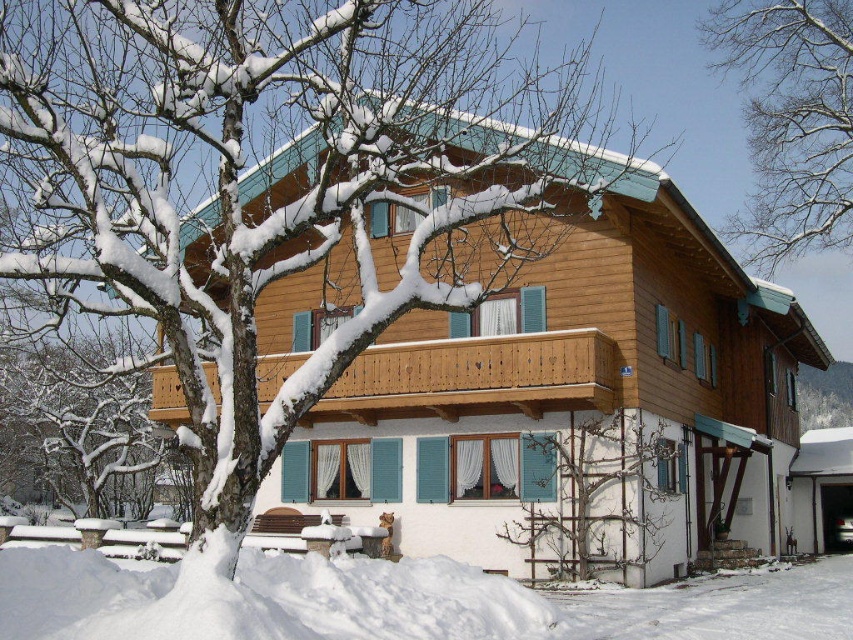
Between bare branches at upper center and wooden at center, which one is positioned lower?

wooden at center is lower down.

Can you confirm if bare branches at upper center is taller than wooden at center?

Yes.

Between point (811, 48) and point (355, 372), which one is positioned in front?

Point (355, 372)

Find the location of a particular element. The image size is (853, 640). bare branches at upper center is located at coordinates (791, 122).

Who is positioned more to the left, snow-covered wooden tree at upper left or snow-covered wooden tree at left?

Positioned to the left is snow-covered wooden tree at left.

Locate an element on the screen. The image size is (853, 640). snow-covered wooden tree at upper left is located at coordinates (276, 182).

Does snow-covered wooden tree at upper left appear on the right side of bare wood trellis at lower center?

In fact, snow-covered wooden tree at upper left is to the left of bare wood trellis at lower center.

Does point (183, 310) come behind point (602, 541)?

No, it is in front of (602, 541).

Who is more distant from viewer, (196, 134) or (576, 563)?

Positioned behind is point (576, 563).

Identify the location of snow-covered wooden tree at upper left. The height and width of the screenshot is (640, 853). (276, 182).